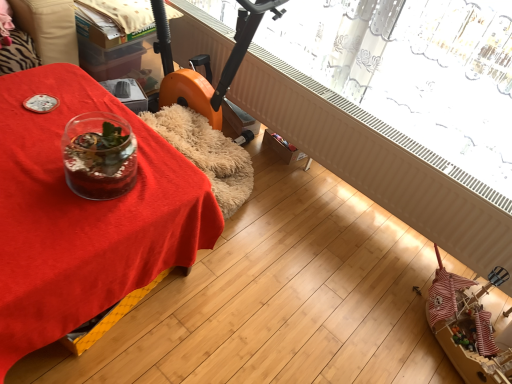
Question: Should I look upward or downward to see transparent glass vase at left?

Choices:
 (A) up
 (B) down

Answer: (B)

Question: Could you tell me if transparent glass window at upper center is facing transparent glass vase at left?

Choices:
 (A) no
 (B) yes

Answer: (B)

Question: From a real-world perspective, is transparent glass window at upper center over transparent glass vase at left?

Choices:
 (A) no
 (B) yes

Answer: (B)

Question: Is transparent glass vase at left a part of transparent glass window at upper center?

Choices:
 (A) yes
 (B) no

Answer: (B)

Question: From a real-world perspective, is transparent glass window at upper center under transparent glass vase at left?

Choices:
 (A) no
 (B) yes

Answer: (A)

Question: Would you consider transparent glass window at upper center to be distant from transparent glass vase at left?

Choices:
 (A) yes
 (B) no

Answer: (A)

Question: Is transparent glass window at upper center shorter than transparent glass vase at left?

Choices:
 (A) yes
 (B) no

Answer: (A)

Question: Does transparent glass vase at left have a lesser width compared to transparent glass window at upper center?

Choices:
 (A) yes
 (B) no

Answer: (B)

Question: Is transparent glass vase at left oriented away from transparent glass window at upper center?

Choices:
 (A) yes
 (B) no

Answer: (A)

Question: Can you confirm if transparent glass vase at left is shorter than transparent glass window at upper center?

Choices:
 (A) yes
 (B) no

Answer: (B)

Question: Is transparent glass vase at left far from transparent glass window at upper center?

Choices:
 (A) no
 (B) yes

Answer: (B)

Question: Is transparent glass vase at left facing towards transparent glass window at upper center?

Choices:
 (A) yes
 (B) no

Answer: (B)

Question: Is the position of transparent glass vase at left less distant than that of transparent glass window at upper center?

Choices:
 (A) yes
 (B) no

Answer: (A)

Question: Looking at the image, does transparent glass vase at left seem bigger or smaller compared to transparent glass window at upper center?

Choices:
 (A) small
 (B) big

Answer: (B)